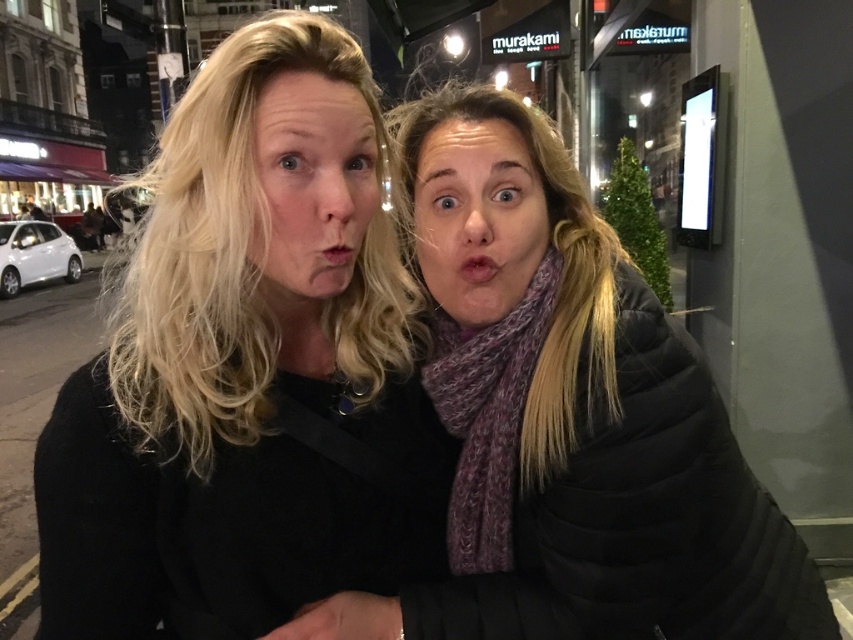
You are a photographer trying to adjust the lighting for a portrait. You notice the matte black jacket at left and the matte black face at center in your frame. Which object should you focus on to ensure proper exposure since it appears larger in the photo?

The matte black jacket at left is taller than the matte black face at center, so focusing on the matte black jacket at left would be better for proper exposure as it is larger in the frame.

You are a photographer trying to capture the perfect shot of the matte black face at center and the purple scarf at center. Based on their positions, which object is closer to the camera?

The matte black face at center is positioned under the purple scarf at center, so the purple scarf at center is closer to the camera.

You are a photographer adjusting the camera focus. You need to ensure both the matte black jacket at left and the purple scarf at center are in focus. Given their sizes, which object should you focus on first to maximize the chances of both being sharp?

The matte black jacket at left is larger in size than the purple scarf at center. To maximize focus on both, you should focus on the larger matte black jacket at left first, as larger objects often require more precise focus adjustments.